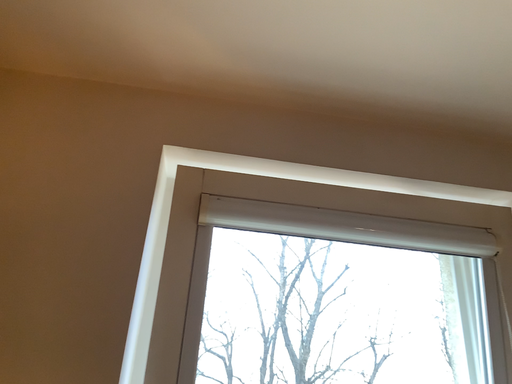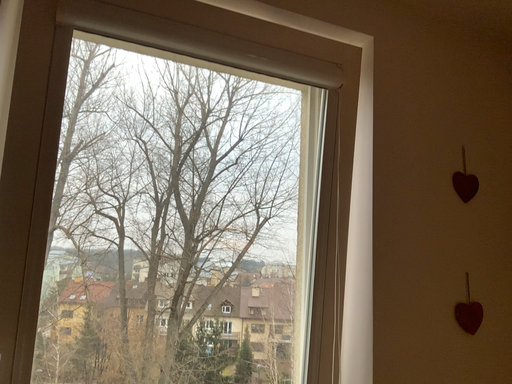
Question: How did the camera likely rotate when shooting the video?

Choices:
 (A) rotated upward
 (B) rotated downward

Answer: (B)